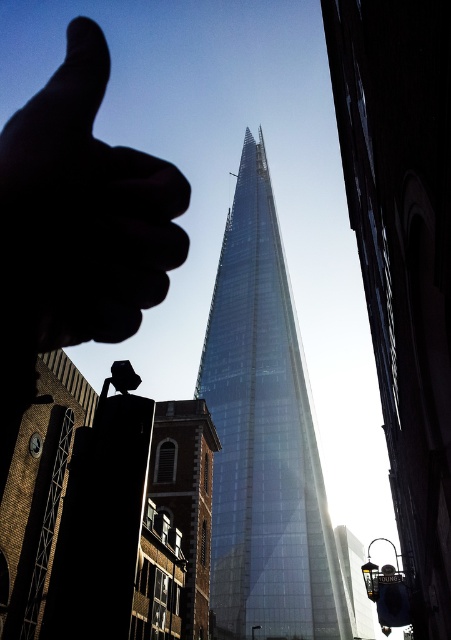
Question: Which object is closer to the camera taking this photo?

Choices:
 (A) black matte hand at upper left
 (B) transparent glass tower at center

Answer: (A)

Question: In this image, where is transparent glass tower at center located relative to black matte hand at upper left?

Choices:
 (A) left
 (B) right

Answer: (B)

Question: Observing the image, what is the correct spatial positioning of transparent glass tower at center in reference to black matte hand at upper left?

Choices:
 (A) below
 (B) above

Answer: (B)

Question: Which object appears closest to the camera in this image?

Choices:
 (A) transparent glass tower at center
 (B) black matte hand at upper left

Answer: (B)

Question: Can you confirm if transparent glass tower at center is positioned to the left of black matte hand at upper left?

Choices:
 (A) no
 (B) yes

Answer: (A)